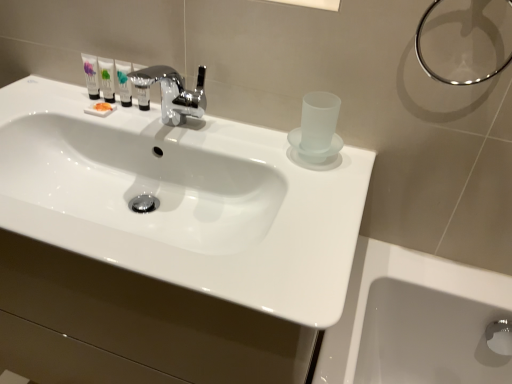
Identify the location of vacant space in front of matte white tube at upper left, which ranks as the 3th mouthwash in right-to-left order. This screenshot has width=512, height=384. (100, 124).